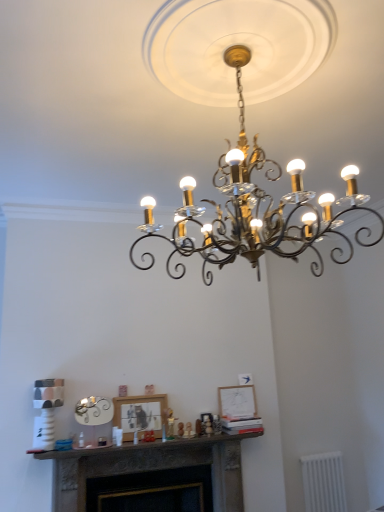
Find the location of a particular element. empty space that is ontop of black wrought iron chandelier at center (from a real-world perspective) is located at coordinates (210, 37).